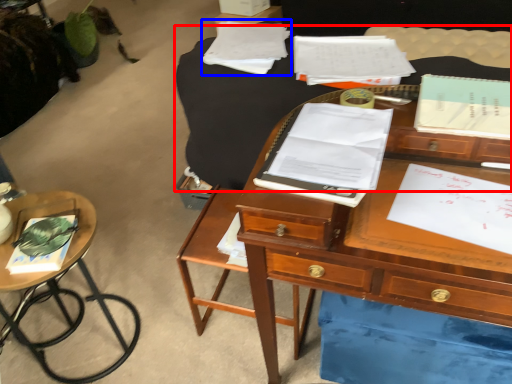
Question: Which object is further to the camera taking this photo, table (highlighted by a red box) or notebook (highlighted by a blue box)?

Choices:
 (A) table
 (B) notebook

Answer: (B)